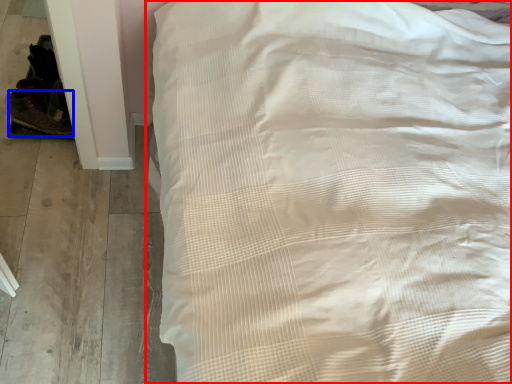
Question: Which of the following is the closest to the observer, bed (highlighted by a red box) or shoe (highlighted by a blue box)?

Choices:
 (A) bed
 (B) shoe

Answer: (A)